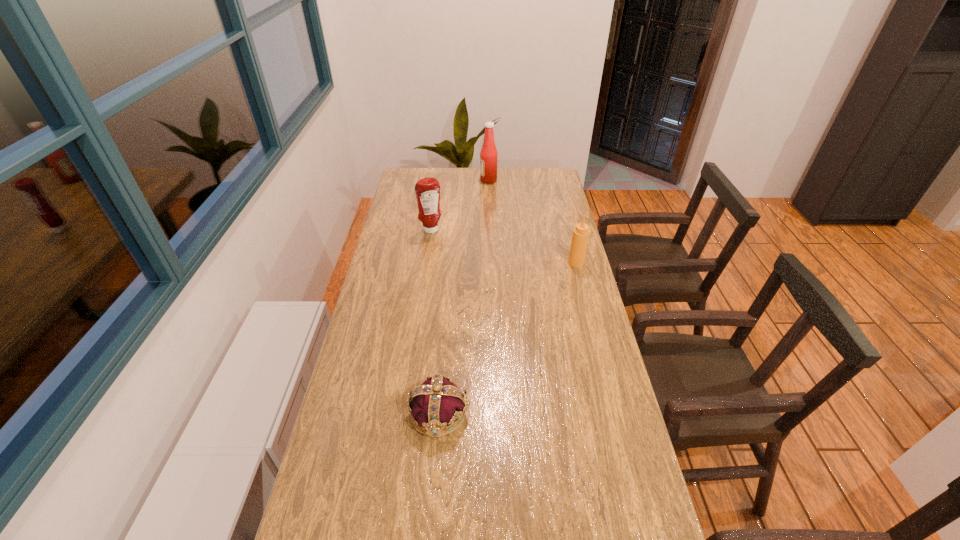
This screenshot has width=960, height=540. I want to click on free space at the far left corner of the desktop, so click(428, 169).

This screenshot has width=960, height=540. In the image, there is a desktop. Find the location of `vacant area at the far right corner`. vacant area at the far right corner is located at coordinates (555, 178).

Where is `vacant area that lies between the second nearest object and the nearest object`? Image resolution: width=960 pixels, height=540 pixels. vacant area that lies between the second nearest object and the nearest object is located at coordinates (508, 338).

What are the coordinates of `vacant space that's between the third nearest object and the second condiment from right to left` in the screenshot? It's located at (460, 205).

Where is `empty space that is in between the farthest condiment and the second nearest object`? The height and width of the screenshot is (540, 960). empty space that is in between the farthest condiment and the second nearest object is located at coordinates (532, 221).

Image resolution: width=960 pixels, height=540 pixels. What are the coordinates of `free space between the nearest object and the farthest object` in the screenshot? It's located at (464, 296).

At what (x,y) coordinates should I click in order to perform the action: click on vacant area that lies between the tallest condiment and the nearest condiment. Please return your answer as a coordinate pair (x, y). Looking at the image, I should click on (532, 221).

The image size is (960, 540). In order to click on free point between the rightmost object and the leftmost condiment in this screenshot , I will do `click(504, 246)`.

In order to click on empty space between the farthest condiment and the rightmost object in this screenshot , I will do `click(532, 221)`.

This screenshot has height=540, width=960. Find the location of `vacant space that's between the rightmost condiment and the second farthest object`. vacant space that's between the rightmost condiment and the second farthest object is located at coordinates (504, 246).